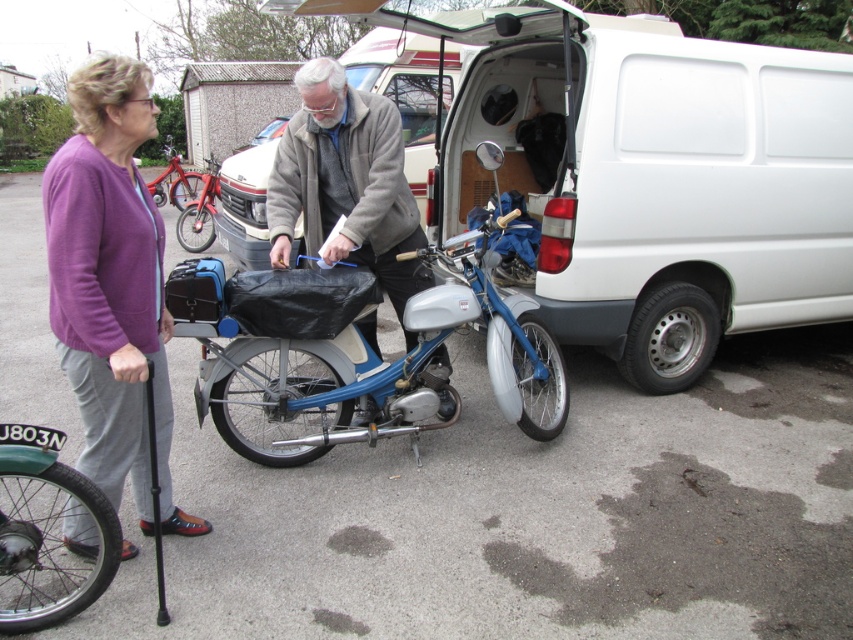
Does purple soft sweater at left appear under metallic red bicycle at left?

Correct, purple soft sweater at left is located below metallic red bicycle at left.

Between purple soft sweater at left and metallic red bicycle at left, which one is positioned lower?

purple soft sweater at left

Does point (96, 541) come behind point (172, 145)?

No, (96, 541) is closer to viewer.

The width and height of the screenshot is (853, 640). I want to click on purple soft sweater at left, so 111,284.

Which is more to the right, purple soft sweater at left or green rubber tire at lower left?

purple soft sweater at left is more to the right.

Which is more to the left, purple soft sweater at left or green rubber tire at lower left?

green rubber tire at lower left

Does point (107, 396) lie in front of point (106, 557)?

No, (107, 396) is further to viewer.

In order to click on purple soft sweater at left in this screenshot , I will do `click(111, 284)`.

Is point (361, 198) positioned behind point (172, 182)?

No, it is not.

Which is below, gray woolen jacket at center or metallic red bicycle at left?

Positioned lower is gray woolen jacket at center.

Which is in front, point (320, 68) or point (178, 192)?

Positioned in front is point (320, 68).

The width and height of the screenshot is (853, 640). Find the location of `gray woolen jacket at center`. gray woolen jacket at center is located at coordinates click(x=346, y=182).